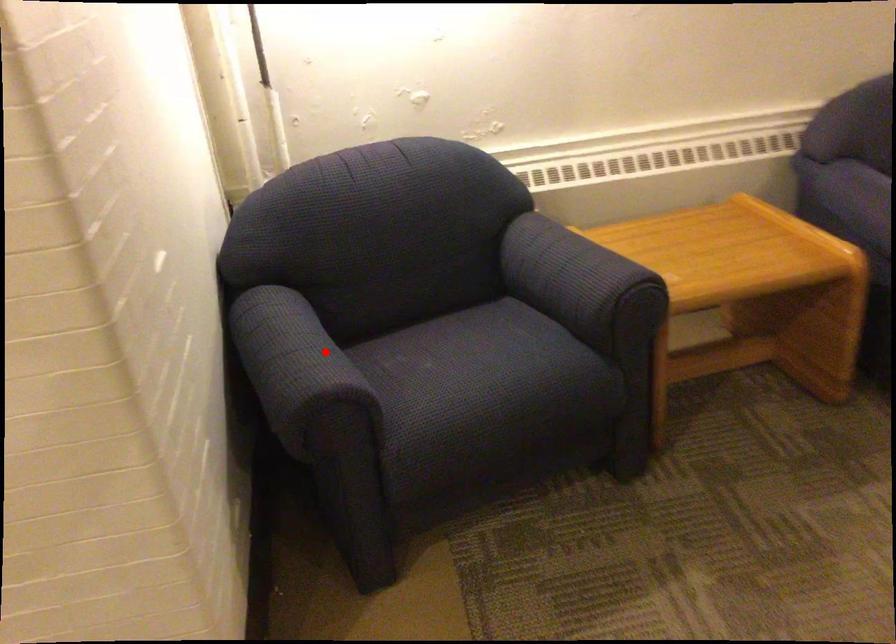
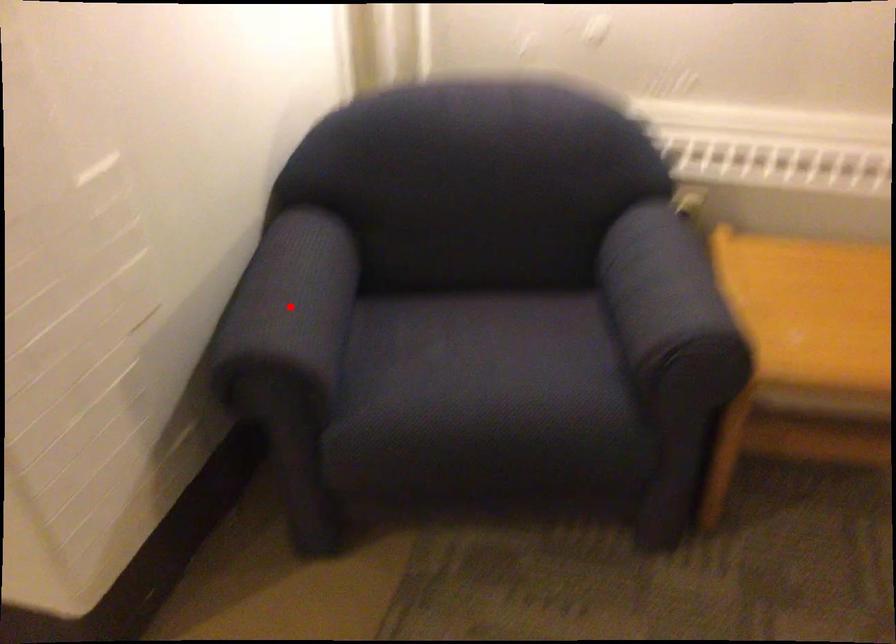
From the picture: I am providing you with two images of the same scene from different viewpoints. A red point is marked on the first image and another point is marked on the second image. Is the red point in image1 aligned with the point shown in image2?

Yes